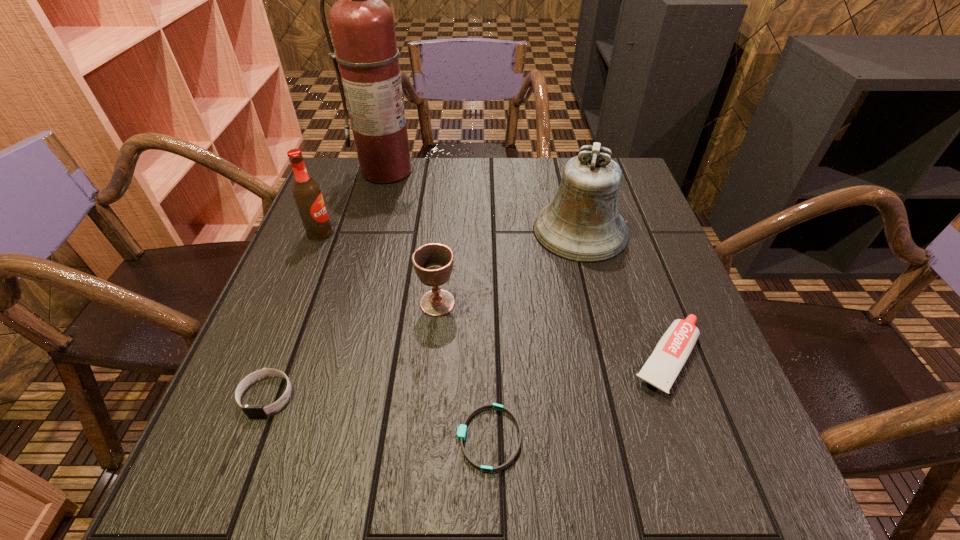
The image size is (960, 540). I want to click on blank region between the fourth shortest object and the bell, so click(509, 267).

Where is `free spot between the beer bottle and the fifth object from left to right`? This screenshot has height=540, width=960. free spot between the beer bottle and the fifth object from left to right is located at coordinates (404, 336).

What are the coordinates of `empty location between the third shortest object and the right wristband` in the screenshot? It's located at (578, 398).

Where is `vacant area between the beer bottle and the fourth farthest object`? The width and height of the screenshot is (960, 540). vacant area between the beer bottle and the fourth farthest object is located at coordinates (378, 268).

Locate an element on the screen. The image size is (960, 540). empty location between the taller wristband and the fifth object from left to right is located at coordinates (378, 417).

Point out which object is positioned as the second nearest to the beer bottle. Please provide its 2D coordinates. Your answer should be formatted as a tuple, i.e. [(x, y)], where the tuple contains the x and y coordinates of a point satisfying the conditions above.

[(433, 263)]

Choose which object is the fourth nearest neighbor to the fourth tallest object. Please provide its 2D coordinates. Your answer should be formatted as a tuple, i.e. [(x, y)], where the tuple contains the x and y coordinates of a point satisfying the conditions above.

[(306, 192)]

Locate an element on the screen. The image size is (960, 540). free space that satisfies the following two spatial constraints: 1. on the front-facing side of the toothpaste; 2. on the left side of the tallest object is located at coordinates (337, 358).

Identify the location of free space that satisfies the following two spatial constraints: 1. on the front side of the chalice; 2. on the left side of the beer bottle. (292, 303).